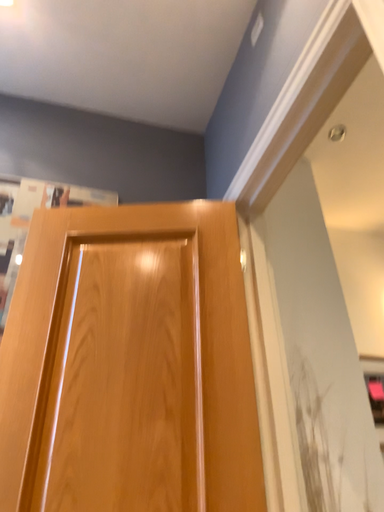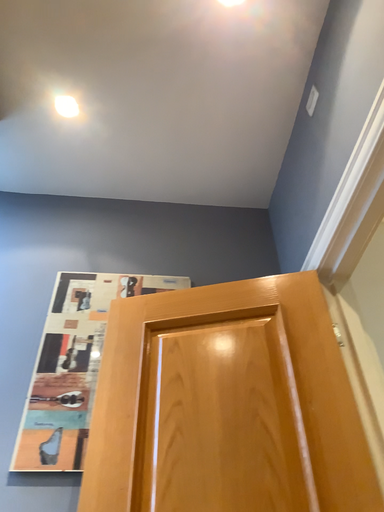
Question: Which way did the camera rotate in the video?

Choices:
 (A) rotated left
 (B) rotated right

Answer: (A)